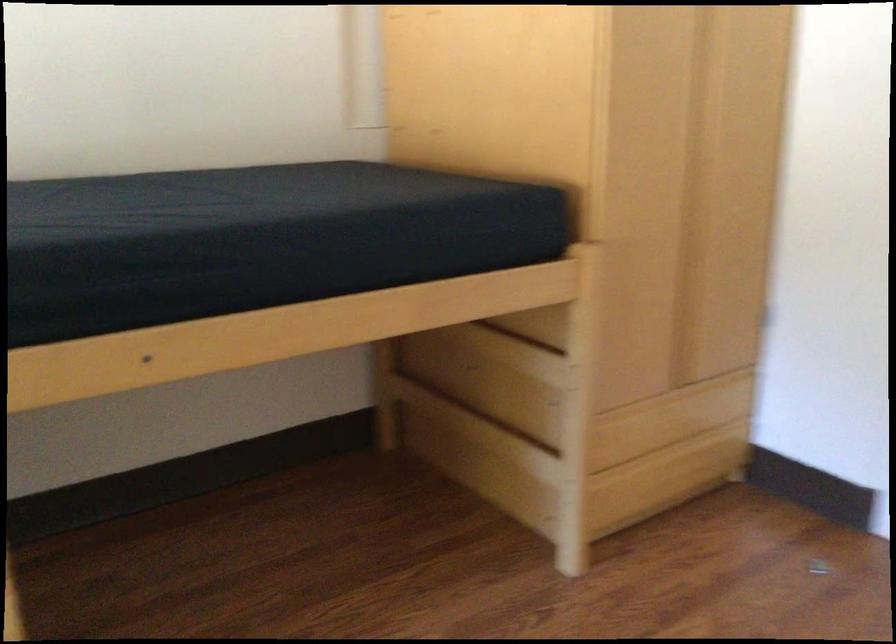
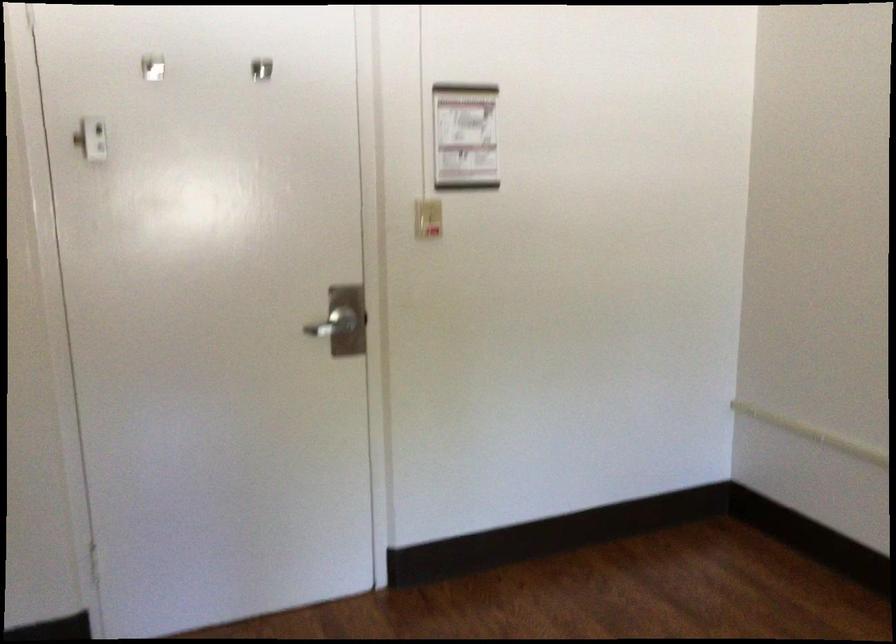
Question: The images are taken continuously from a first-person perspective. In which direction is your viewpoint rotating?

Choices:
 (A) Left
 (B) Right
 (C) Up
 (D) Down

Answer: (B)